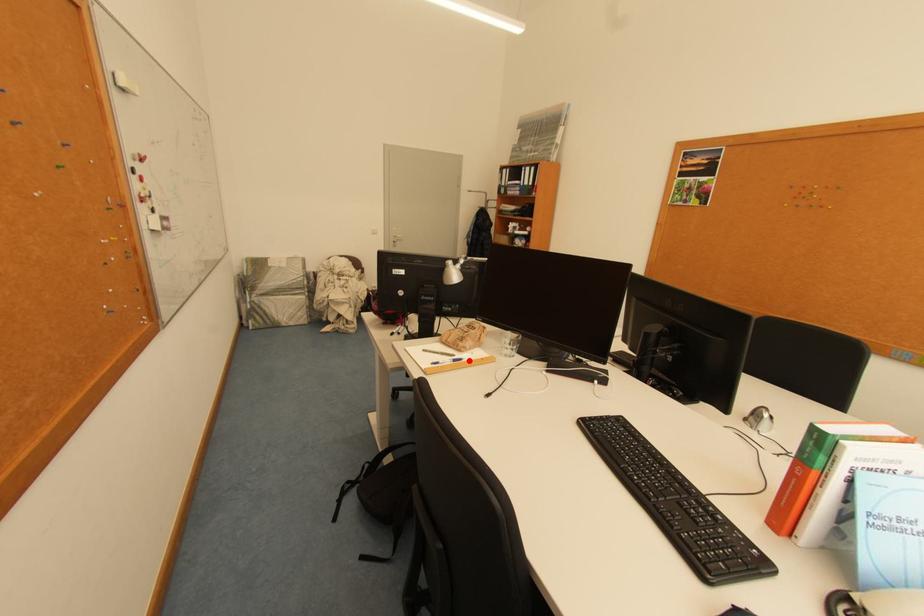
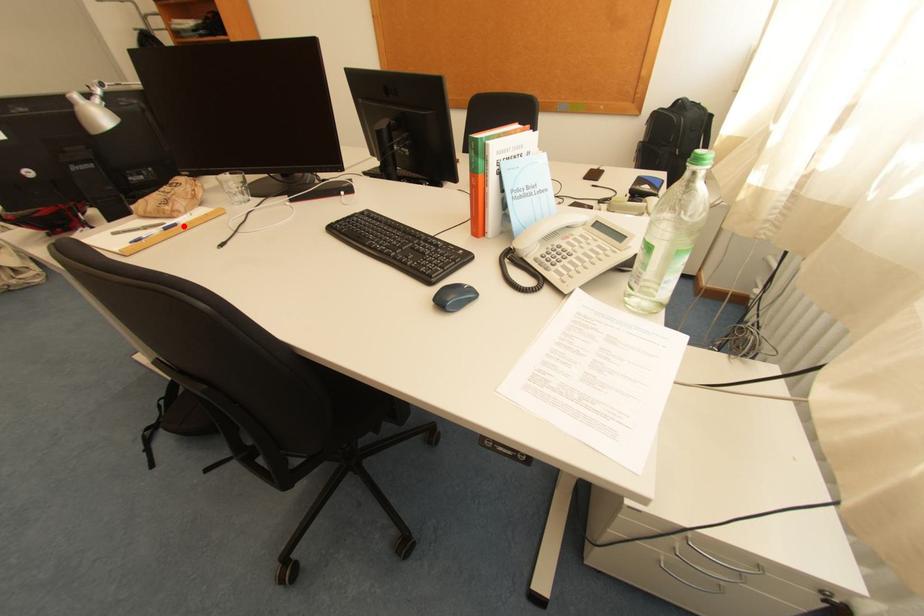
I am providing you with two images of the same scene from different viewpoints. A red point is marked on the first image and another point is marked on the second image. Are the points marked in image1 and image2 representing the same 3D position?

Yes